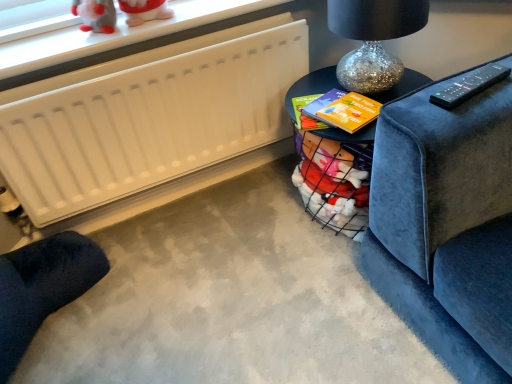
Where is `vacant space that is to the left of black glossy table at center, the first table in the front-to-back sequence`? vacant space that is to the left of black glossy table at center, the first table in the front-to-back sequence is located at coordinates (240, 244).